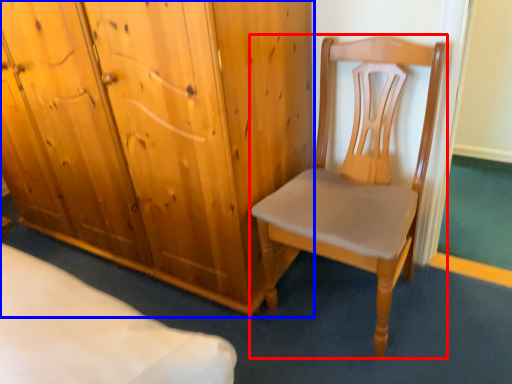
Question: Which of the following is the farthest to the observer, chair (highlighted by a red box) or cupboard (highlighted by a blue box)?

Choices:
 (A) chair
 (B) cupboard

Answer: (B)